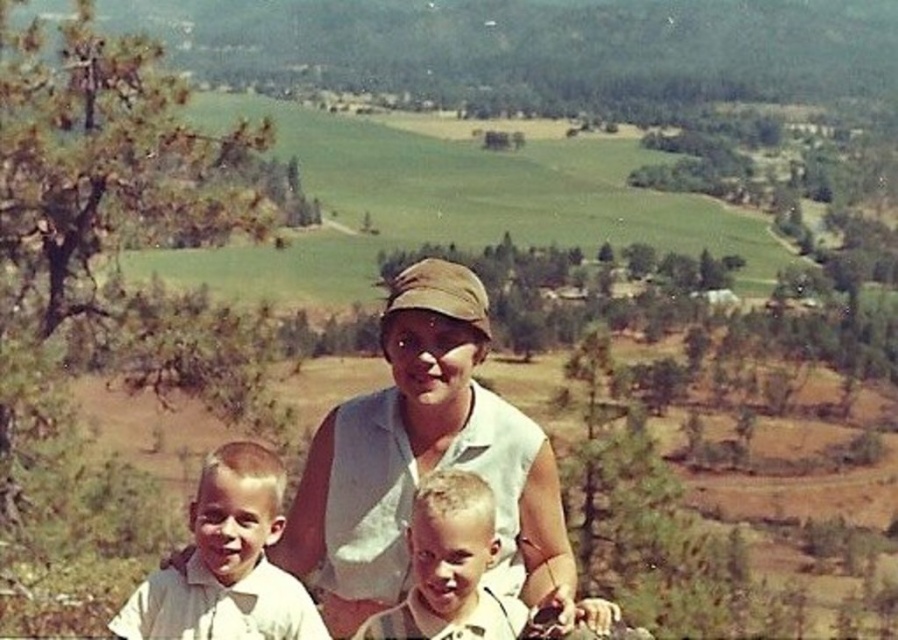
Does white cotton shirt at center have a greater height compared to light brown hair at center?

Yes, white cotton shirt at center is taller than light brown hair at center.

At what (x,y) coordinates should I click in order to perform the action: click on white cotton shirt at center. Please return your answer as a coordinate pair (x, y). This screenshot has height=640, width=898. Looking at the image, I should click on (425, 461).

Describe the element at coordinates (425, 461) in the screenshot. I see `white cotton shirt at center` at that location.

Locate an element on the screen. The width and height of the screenshot is (898, 640). white cotton shirt at center is located at coordinates (425, 461).

Is the position of white cotton shirt at center more distant than that of white cotton shirt at left?

Yes, white cotton shirt at center is further from the viewer.

Which is behind, point (307, 509) or point (153, 584)?

The point (307, 509) is more distant.

Locate an element on the screen. white cotton shirt at center is located at coordinates (425, 461).

Does white cotton shirt at left appear on the left side of light brown hair at center?

Correct, you'll find white cotton shirt at left to the left of light brown hair at center.

This screenshot has height=640, width=898. Identify the location of white cotton shirt at left. (226, 563).